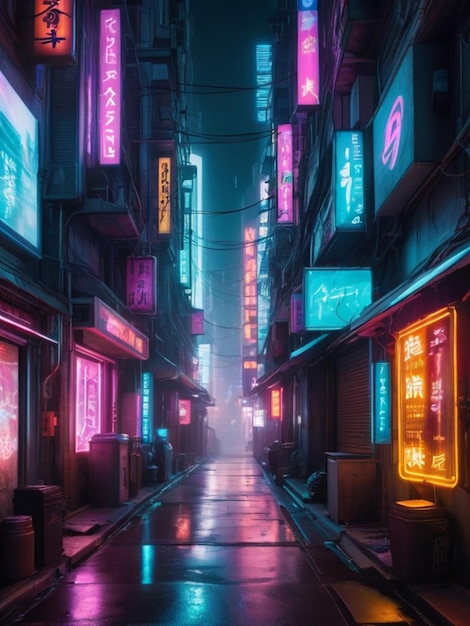
This screenshot has height=626, width=470. In order to click on door to garage in this screenshot , I will do `click(357, 403)`.